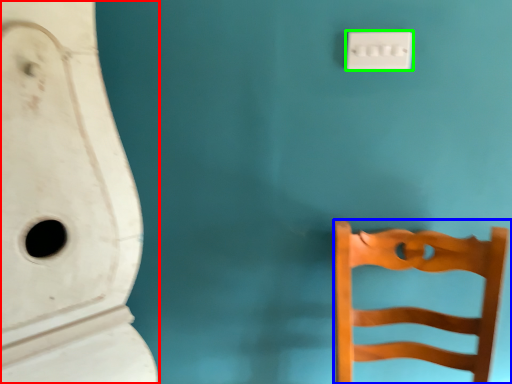
Question: Which is farther away from urinal (highlighted by a red box)? furniture (highlighted by a blue box) or light switch (highlighted by a green box)?

Choices:
 (A) furniture
 (B) light switch

Answer: (B)